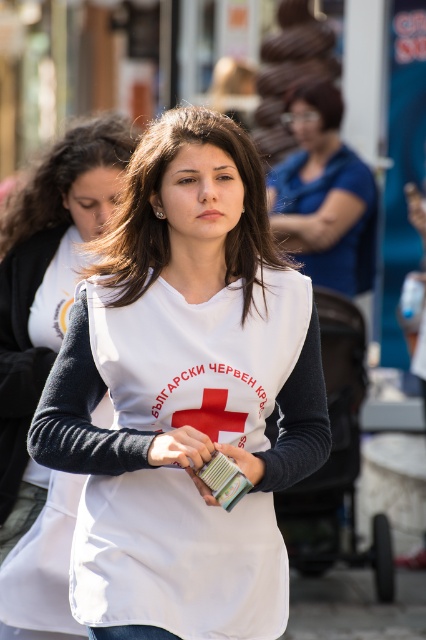
Question: Estimate the real-world distances between objects in this image. Which object is closer to the denim at center?

Choices:
 (A) white matte vest at center
 (B) blue fabric shirt at upper center

Answer: (A)

Question: Does white matte vest at left have a greater width compared to blue fabric shirt at upper center?

Choices:
 (A) yes
 (B) no

Answer: (B)

Question: Among these points, which one is nearest to the camera?

Choices:
 (A) (351, 180)
 (B) (115, 627)

Answer: (B)

Question: Does blue fabric shirt at upper center appear on the right side of denim at center?

Choices:
 (A) yes
 (B) no

Answer: (A)

Question: Which of the following is the farthest from the observer?

Choices:
 (A) (66, 548)
 (B) (342, 272)
 (C) (141, 630)

Answer: (B)

Question: Does white matte vest at center have a greater width compared to denim at center?

Choices:
 (A) no
 (B) yes

Answer: (B)